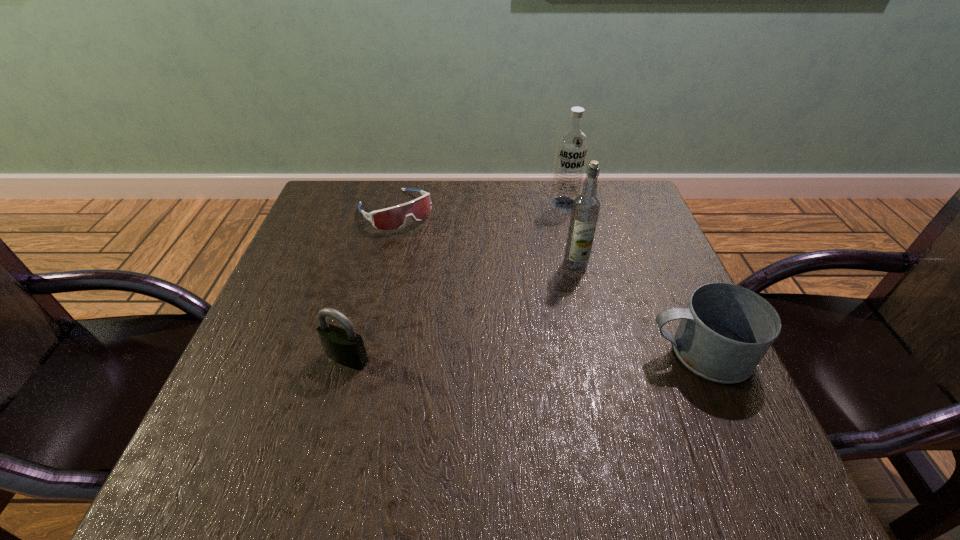
You are a GUI agent. You are given a task and a screenshot of the screen. Output one action in this format:
    pyautogui.click(x=<x>, y=<y>)
    Task: Click on the vacant region located 0.160m on the front-facing side of the shortest object
    
    Given the screenshot: What is the action you would take?
    pyautogui.click(x=444, y=265)

At what (x,y) coordinates should I click in order to perform the action: click on vacant space situated on the front-facing side of the shortest object. Please return your answer as a coordinate pair (x, y). The image size is (960, 540). Looking at the image, I should click on (481, 307).

Where is `vacant space located 0.360m on the front label of the farther vodka`? vacant space located 0.360m on the front label of the farther vodka is located at coordinates (540, 308).

At what (x,y) coordinates should I click in order to perform the action: click on vacant space located on the front label of the farther vodka. Please return your answer as a coordinate pair (x, y). The height and width of the screenshot is (540, 960). Looking at the image, I should click on click(x=556, y=237).

The height and width of the screenshot is (540, 960). I want to click on free space located on the front label of the farther vodka, so click(x=549, y=265).

Locate an element on the screen. The width and height of the screenshot is (960, 540). vacant space situated 0.080m on the label of the third nearest object is located at coordinates (552, 292).

This screenshot has height=540, width=960. Identify the location of vacant area situated 0.260m on the label of the third nearest object. (507, 345).

Identify the location of free space located on the label of the third nearest object. This screenshot has height=540, width=960. (494, 358).

The image size is (960, 540). I want to click on goggles located at the far edge, so click(395, 217).

You are a GUI agent. You are given a task and a screenshot of the screen. Output one action in this format:
    pyautogui.click(x=<x>, y=<y>)
    Task: Click on the vodka located at the far edge
    The image size is (960, 540).
    Given the screenshot: What is the action you would take?
    pyautogui.click(x=572, y=145)